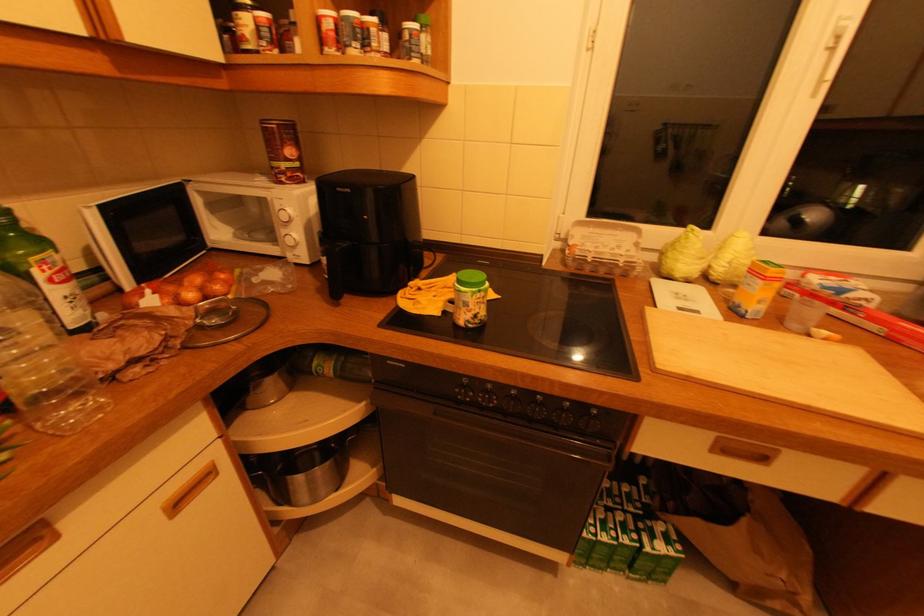
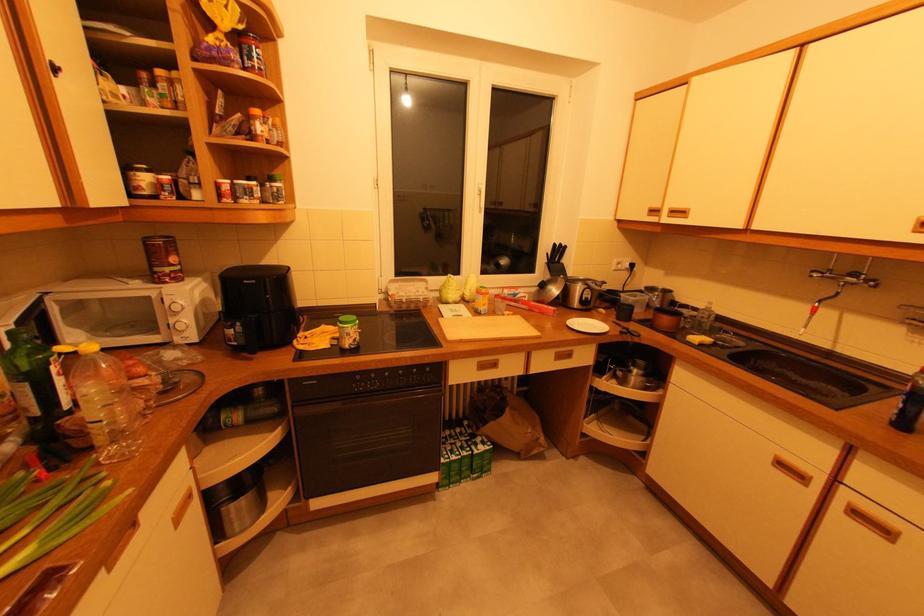
Find the pixel in the second image that matches (396,363) in the first image.

(311, 383)